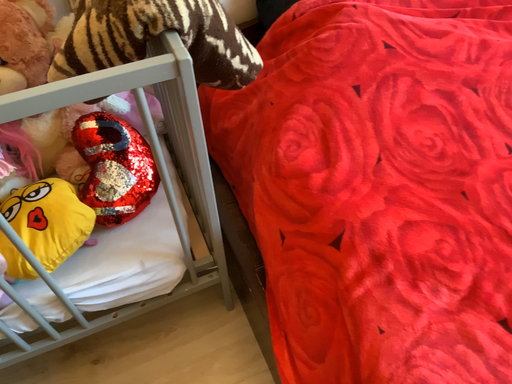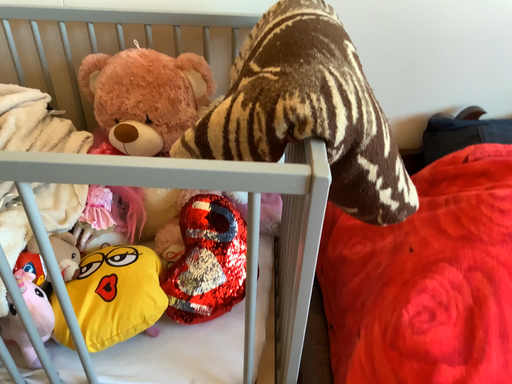
Question: Which way did the camera rotate in the video?

Choices:
 (A) rotated upward
 (B) rotated downward

Answer: (A)